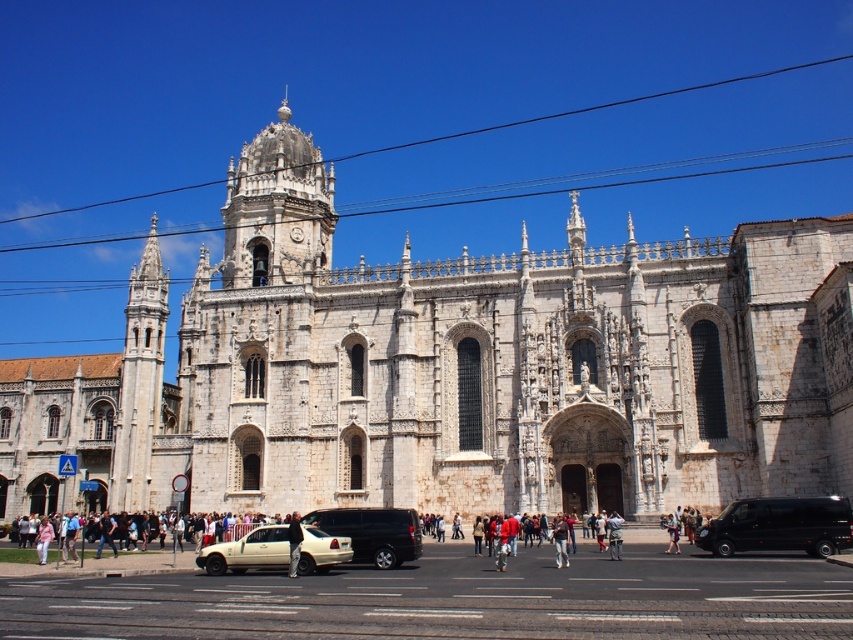
You are standing at the entrance of the white stone church at center. A tourist asks you to describe the location of the church in terms of coordinates. What do you tell them?

The white stone church at center is located at coordinates point (448, 369).

From the picture: You are standing in front of the grand historical building and want to take a photo. You notice two points marked on the ground at coordinates point (x=123, y=368) and point (x=734, y=518). Which point is closer to you as you face the building?

Point (x=123, y=368) is closer to you because it is further to the viewer than point (x=734, y=518).